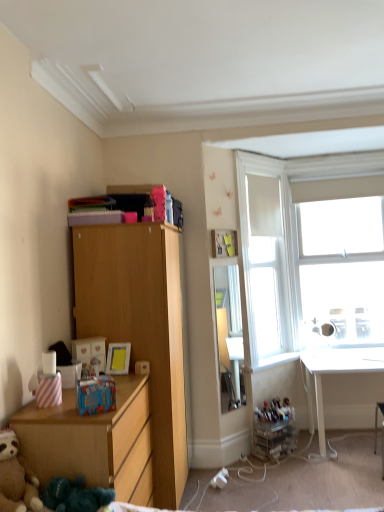
Locate an element on the screen. Image resolution: width=384 pixels, height=512 pixels. free space in front of white plastic power outlet at lower center is located at coordinates (222, 498).